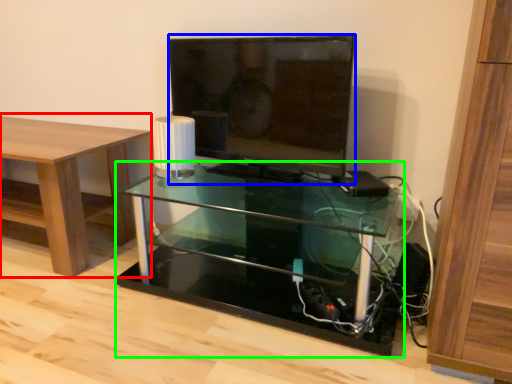
Question: Which object is positioned farthest from table (highlighted by a red box)? Select from television (highlighted by a blue box) and shelf (highlighted by a green box).

Choices:
 (A) television
 (B) shelf

Answer: (A)